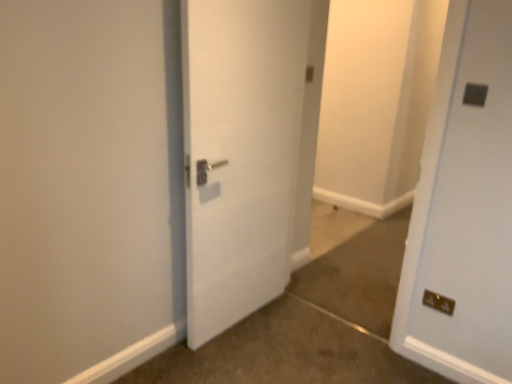
Question: Does dark gray plastic electric outlet at upper right, which is the first electric outlet from top to bottom, have a greater height compared to brown carpet at lower right?

Choices:
 (A) yes
 (B) no

Answer: (A)

Question: Does dark gray plastic electric outlet at upper right, placed as the 2th electric outlet when sorted from back to front, lie in front of brown carpet at lower right?

Choices:
 (A) yes
 (B) no

Answer: (B)

Question: Considering the relative sizes of dark gray plastic electric outlet at upper right, placed as the 2th electric outlet when sorted from back to front, and brown carpet at lower right in the image provided, is dark gray plastic electric outlet at upper right, placed as the 2th electric outlet when sorted from back to front, bigger than brown carpet at lower right?

Choices:
 (A) yes
 (B) no

Answer: (B)

Question: From a real-world perspective, is dark gray plastic electric outlet at upper right, which is the first electric outlet from top to bottom, below brown carpet at lower right?

Choices:
 (A) yes
 (B) no

Answer: (B)

Question: Is dark gray plastic electric outlet at upper right, which appears as the 2th electric outlet when ordered from the bottom, looking in the opposite direction of brown carpet at lower right?

Choices:
 (A) yes
 (B) no

Answer: (B)

Question: From a real-world perspective, is brown carpet at lower right above or below white matte door at center?

Choices:
 (A) above
 (B) below

Answer: (B)

Question: Relative to white matte door at center, is brown carpet at lower right in front or behind?

Choices:
 (A) front
 (B) behind

Answer: (A)

Question: Based on their sizes in the image, would you say brown carpet at lower right is bigger or smaller than white matte door at center?

Choices:
 (A) small
 (B) big

Answer: (A)

Question: Considering the relative positions of brown carpet at lower right and white matte door at center in the image provided, is brown carpet at lower right to the left or to the right of white matte door at center?

Choices:
 (A) left
 (B) right

Answer: (B)

Question: Considering the positions of brown carpet at lower right and metallic gold electrical outlet at lower right, the first electric outlet from the bottom, in the image, is brown carpet at lower right bigger or smaller than metallic gold electrical outlet at lower right, the first electric outlet from the bottom,?

Choices:
 (A) small
 (B) big

Answer: (B)

Question: Is brown carpet at lower right wider or thinner than metallic gold electrical outlet at lower right, which is counted as the second electric outlet, starting from the top?

Choices:
 (A) thin
 (B) wide

Answer: (B)

Question: From their relative heights in the image, would you say brown carpet at lower right is taller or shorter than metallic gold electrical outlet at lower right, which is the 2th electric outlet in front-to-back order?

Choices:
 (A) short
 (B) tall

Answer: (A)

Question: From the image's perspective, is brown carpet at lower right above or below metallic gold electrical outlet at lower right, the first electric outlet from the bottom?

Choices:
 (A) below
 (B) above

Answer: (A)

Question: Is brown carpet at lower right in front of or behind dark gray plastic electric outlet at upper right, placed as the 2th electric outlet when sorted from back to front, in the image?

Choices:
 (A) behind
 (B) front

Answer: (B)

Question: Considering the positions of point (131, 375) and point (484, 92), is point (131, 375) closer or farther from the camera than point (484, 92)?

Choices:
 (A) closer
 (B) farther

Answer: (B)